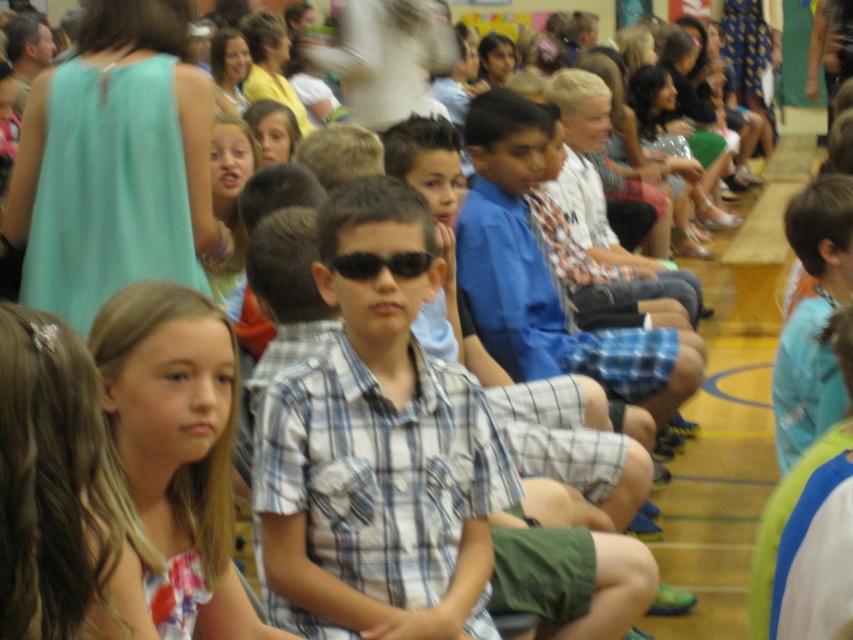
Question: Among these objects, which one is farthest from the camera?

Choices:
 (A) plaid shirt at center
 (B) black plastic sunglasses at center
 (C) blue plaid shirt at center

Answer: (C)

Question: Where is blue plaid shirt at center located in relation to black plastic sunglasses at center in the image?

Choices:
 (A) right
 (B) left

Answer: (A)

Question: Is plaid shirt at center to the left of black plastic sunglasses at center from the viewer's perspective?

Choices:
 (A) yes
 (B) no

Answer: (B)

Question: Which object is farther from the camera taking this photo?

Choices:
 (A) plaid shirt at center
 (B) black plastic sunglasses at center

Answer: (B)

Question: Which point appears closest to the camera in this image?

Choices:
 (A) (358, 180)
 (B) (392, 266)
 (C) (689, 336)

Answer: (B)

Question: Is plaid shirt at center wider than black plastic sunglasses at center?

Choices:
 (A) no
 (B) yes

Answer: (B)